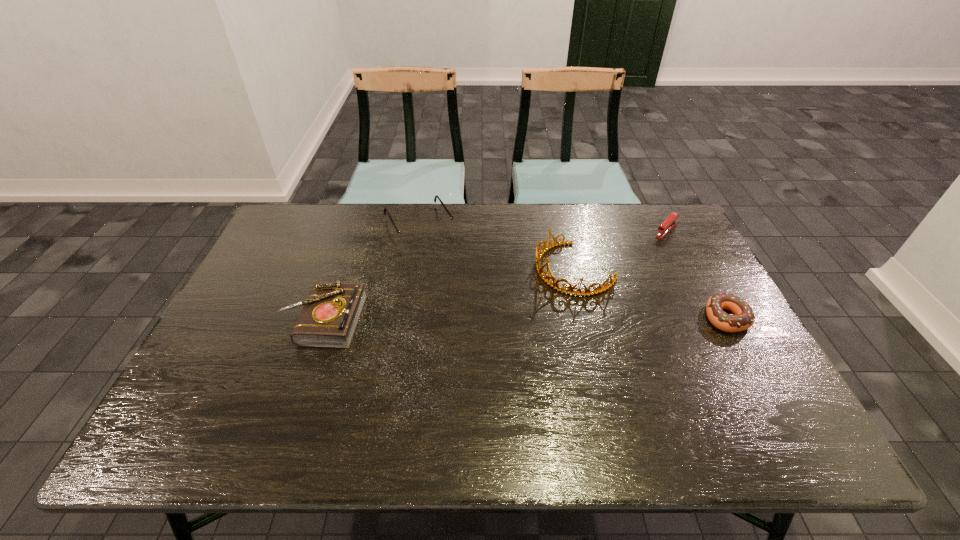
I want to click on free space on the desktop that is between the diary and the doughnut and is positioned on the front-facing side of the tiara, so click(478, 319).

Locate an element on the screen. Image resolution: width=960 pixels, height=540 pixels. free space on the desktop that is between the diary and the doughnut and is positioned on the front-facing side of the stapler is located at coordinates (580, 319).

This screenshot has width=960, height=540. In order to click on free space on the desktop that is between the diary and the doughnut and is positioned at the hinge ends of the spectacles in this screenshot , I will do `click(476, 319)`.